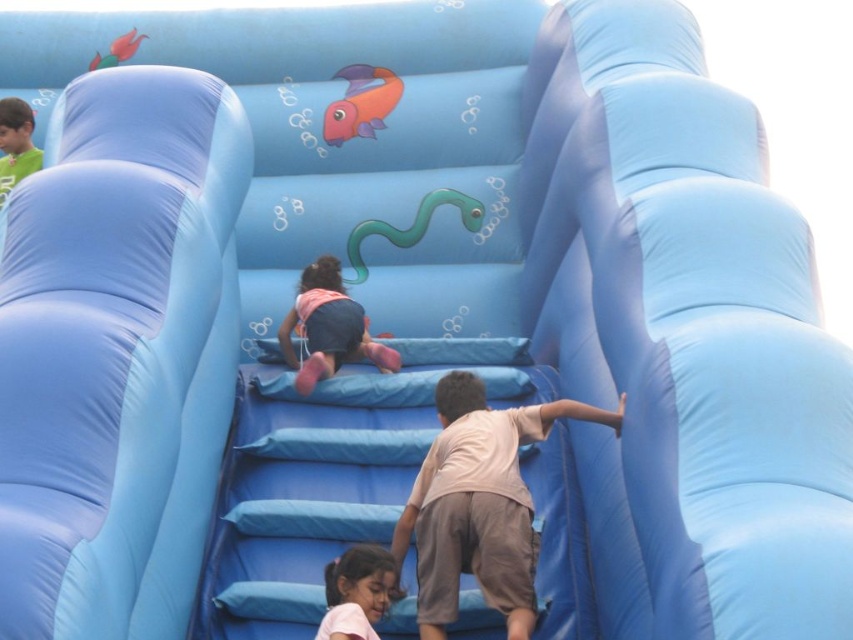
Is blue fabric slide at center in front of matte pink shorts at lower center?

Yes, it is in front of matte pink shorts at lower center.

Does blue fabric slide at center appear on the left side of matte pink shorts at lower center?

Indeed, blue fabric slide at center is positioned on the left side of matte pink shorts at lower center.

Identify the location of blue fabric slide at center. The width and height of the screenshot is (853, 640). (117, 355).

Between point (616, 588) and point (228, 195), which one is positioned behind?

Point (228, 195)

What do you see at coordinates (683, 336) in the screenshot? Image resolution: width=853 pixels, height=640 pixels. I see `blue fabric slide at right` at bounding box center [683, 336].

Where is `blue fabric slide at right`? The image size is (853, 640). blue fabric slide at right is located at coordinates pyautogui.click(x=683, y=336).

Consider the image. Which is more to the right, pink fabric shorts at center or matte pink shorts at lower center?

From the viewer's perspective, matte pink shorts at lower center appears more on the right side.

Is pink fabric shorts at center thinner than matte pink shorts at lower center?

No, pink fabric shorts at center is not thinner than matte pink shorts at lower center.

Describe the element at coordinates (328, 326) in the screenshot. I see `pink fabric shorts at center` at that location.

This screenshot has height=640, width=853. I want to click on pink fabric shorts at center, so click(x=328, y=326).